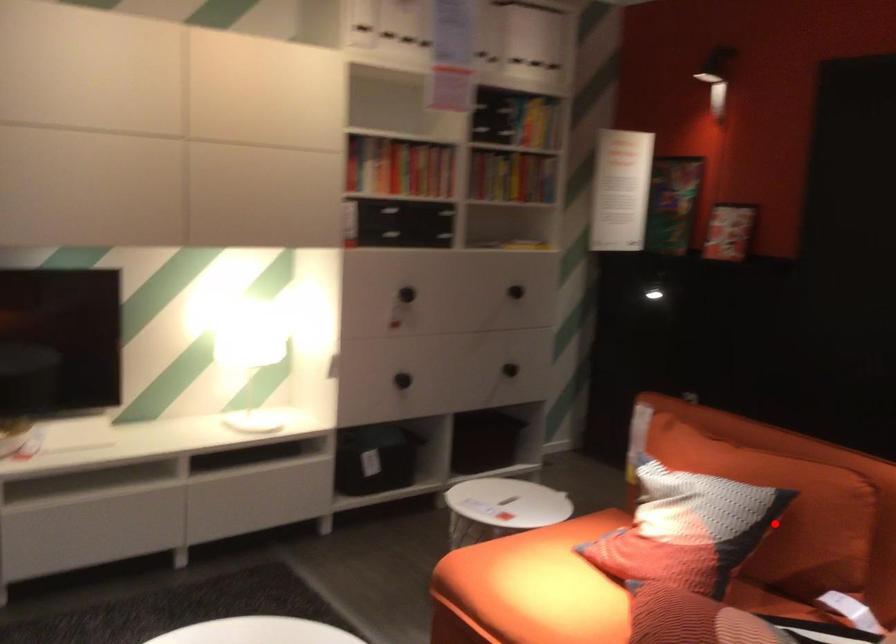
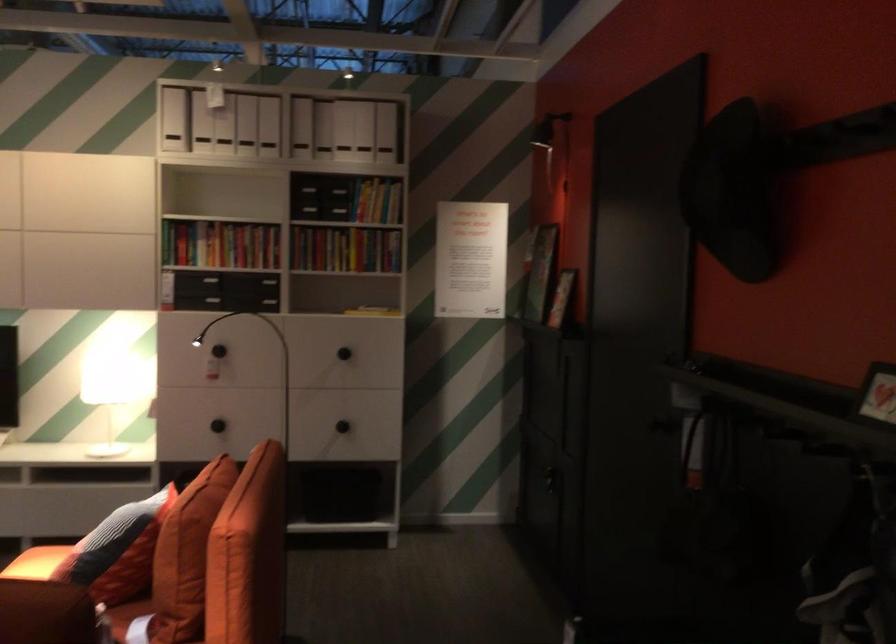
The point at the highlighted location is marked in the first image. Where is the corresponding point in the second image?

(117, 551)